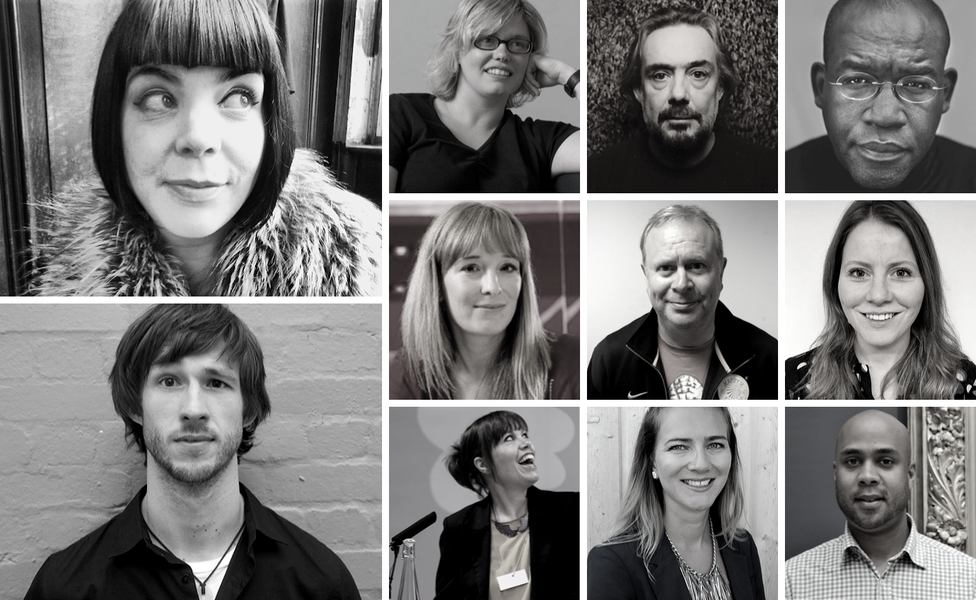
Image resolution: width=976 pixels, height=600 pixels. What are the coordinates of `brick wall` in the screenshot? It's located at (34, 474), (323, 457).